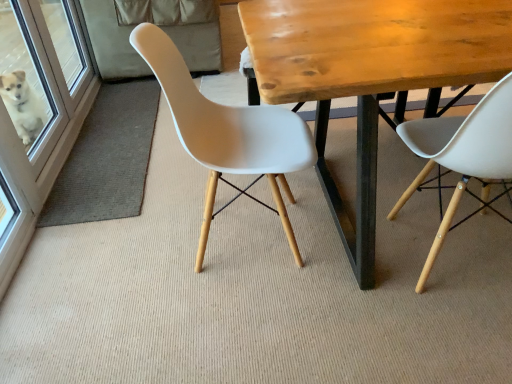
Locate an element on the screen. The image size is (512, 384). vacant area that is situated to the right of white plastic chair at center, the second chair viewed from the right is located at coordinates (354, 220).